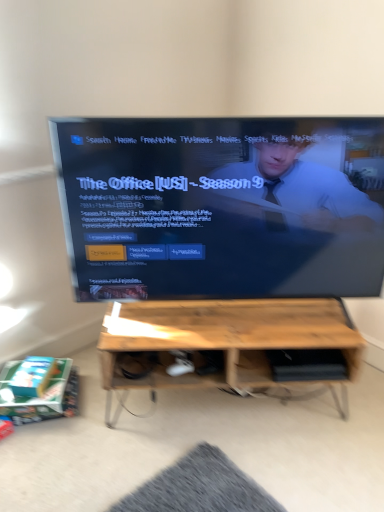
Image resolution: width=384 pixels, height=512 pixels. Find the location of `matte black tv at center`. matte black tv at center is located at coordinates (222, 206).

This screenshot has width=384, height=512. What do you see at coordinates (222, 206) in the screenshot? I see `matte black tv at center` at bounding box center [222, 206].

You are a GUI agent. You are given a task and a screenshot of the screen. Output one action in this format:
    pyautogui.click(x=<x>, y=<y>)
    Task: Click on the wooden table at center
    Image resolution: width=384 pixels, height=512 pixels.
    Given the screenshot: What is the action you would take?
    pyautogui.click(x=229, y=345)

What do you see at coordinates (229, 345) in the screenshot? Image resolution: width=384 pixels, height=512 pixels. I see `wooden table at center` at bounding box center [229, 345].

Find the location of `matte black tv at center`. matte black tv at center is located at coordinates (222, 206).

In the image, is matte black tv at center on the left side or the right side of wooden table at center?

Clearly, matte black tv at center is on the left of wooden table at center in the image.

Considering the relative positions of matte black tv at center and wooden table at center in the image provided, is matte black tv at center behind wooden table at center?

No, it is in front of wooden table at center.

Is point (130, 182) farther from camera compared to point (206, 375)?

No.

From the image's perspective, does matte black tv at center appear higher than wooden table at center?

Yes, from the image's perspective, matte black tv at center is above wooden table at center.

From a real-world perspective, is matte black tv at center physically located above or below wooden table at center?

Clearly, from a real-world perspective, matte black tv at center is above wooden table at center.

Considering the relative sizes of matte black tv at center and wooden table at center in the image provided, is matte black tv at center thinner than wooden table at center?

Indeed, matte black tv at center has a lesser width compared to wooden table at center.

From the picture: Can you confirm if matte black tv at center is taller than wooden table at center?

Yes.

Considering the relative sizes of matte black tv at center and wooden table at center in the image provided, is matte black tv at center smaller than wooden table at center?

No.

From the picture: Choose the correct answer: Is matte black tv at center inside wooden table at center or outside it?

matte black tv at center is outside wooden table at center.

Is there a large distance between matte black tv at center and wooden table at center?

No, matte black tv at center is not far away from wooden table at center.

Is wooden table at center at the back of matte black tv at center?

matte black tv at center is not turned away from wooden table at center.

How different are the orientations of matte black tv at center and wooden table at center in degrees?

They differ by 4e-05 degrees in their facing directions.

Find the location of a particular element. The image size is (384, 512). table below the matte black tv at center (from a real-world perspective) is located at coordinates (229, 345).

Is wooden table at center to the left or to the right of matte black tv at center in the image?

wooden table at center is positioned on matte black tv at center's right side.

In the image, is wooden table at center positioned in front of or behind matte black tv at center?

In the image, wooden table at center appears behind matte black tv at center.

Does point (358, 362) lie behind point (229, 193)?

Yes, it is behind point (229, 193).

From the image's perspective, would you say wooden table at center is shown under matte black tv at center?

Indeed, from the image's perspective, wooden table at center is shown beneath matte black tv at center.

From a real-world perspective, who is located lower, wooden table at center or matte black tv at center?

From a 3D spatial view, wooden table at center is below.

Does wooden table at center have a lesser width compared to matte black tv at center?

Incorrect, the width of wooden table at center is not less than that of matte black tv at center.

Considering the sizes of wooden table at center and matte black tv at center in the image, is wooden table at center taller or shorter than matte black tv at center?

Clearly, wooden table at center is shorter compared to matte black tv at center.

Can you confirm if wooden table at center is smaller than matte black tv at center?

Indeed, wooden table at center has a smaller size compared to matte black tv at center.

Would you say matte black tv at center is part of wooden table at center's contents?

No, matte black tv at center is not surrounded by wooden table at center.

Can you see wooden table at center touching matte black tv at center?

No.

Is wooden table at center turned away from matte black tv at center?

No, wooden table at center is not facing away from matte black tv at center.

From the picture: Measure the distance from wooden table at center to matte black tv at center.

They are 12.87 inches apart.

In the image, there is a matte black tv at center. Where is `table below it (from a real-world perspective)`? This screenshot has width=384, height=512. table below it (from a real-world perspective) is located at coordinates (229, 345).

Where is `table that appears on the right of matte black tv at center`? table that appears on the right of matte black tv at center is located at coordinates (229, 345).

Where is `television in front of the wooden table at center`? The image size is (384, 512). television in front of the wooden table at center is located at coordinates (222, 206).